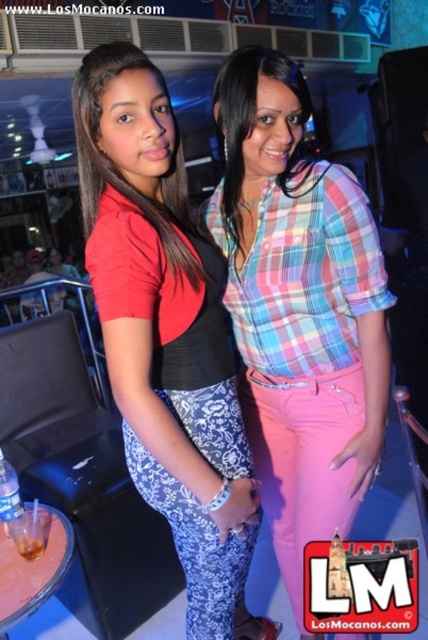
You are a photographer adjusting your camera settings to focus on the plaid fabric shirt at center and the matte black top at center. Which one should you adjust your focus to first to ensure the closest object is sharp?

The plaid fabric shirt at center is closer to you than the matte black top at center, so you should focus on the plaid fabric shirt at center first to ensure sharpness.

You are a photographer at the event and need to ensure both the plaid fabric shirt at center and the matte black top at center are visible in your photo. Given their sizes, which one might require you to adjust your camera angle to capture fully?

The plaid fabric shirt at center occupies less space than the matte black top at center, so the matte black top at center might require adjusting the camera angle to ensure it fits within the frame since it takes up more space.